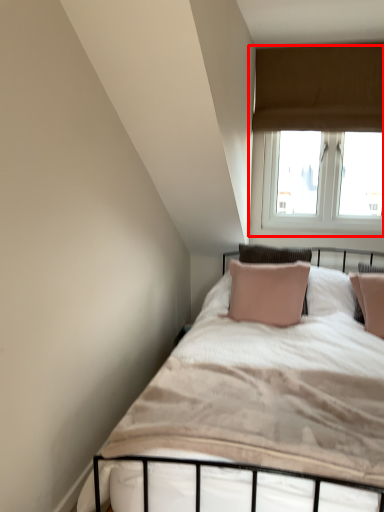
Question: From the image's perspective, what is the correct spatial positioning of window (annotated by the red box) in reference to bed?

Choices:
 (A) above
 (B) below

Answer: (A)